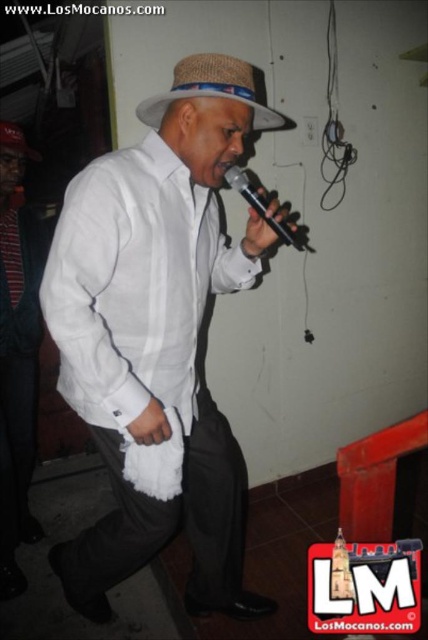
Is white matte shirt at center bigger than woven straw hat at center?

Yes.

Does point (219, 161) come closer to viewer compared to point (202, 77)?

No.

Describe the element at coordinates (157, 332) in the screenshot. I see `white matte shirt at center` at that location.

Identify the location of white matte shirt at center. point(157,332).

Can you confirm if woven straw hat at center is positioned above black plastic microphone at center?

Indeed, woven straw hat at center is positioned over black plastic microphone at center.

Can you confirm if woven straw hat at center is shorter than black plastic microphone at center?

Yes, woven straw hat at center is shorter than black plastic microphone at center.

Based on the photo, who is more forward, (172, 72) or (235, 184)?

Point (235, 184) is in front.

You are a GUI agent. You are given a task and a screenshot of the screen. Output one action in this format:
    pyautogui.click(x=<x>, y=<y>)
    Task: Click on the woven straw hat at center
    
    Given the screenshot: What is the action you would take?
    pyautogui.click(x=211, y=90)

Which is in front, point (166, 100) or point (0, 140)?

Point (166, 100) is more forward.

Between woven straw hat at center and woven straw fedora at upper center, which one has less height?

woven straw hat at center

Identify the location of woven straw hat at center. (211, 90).